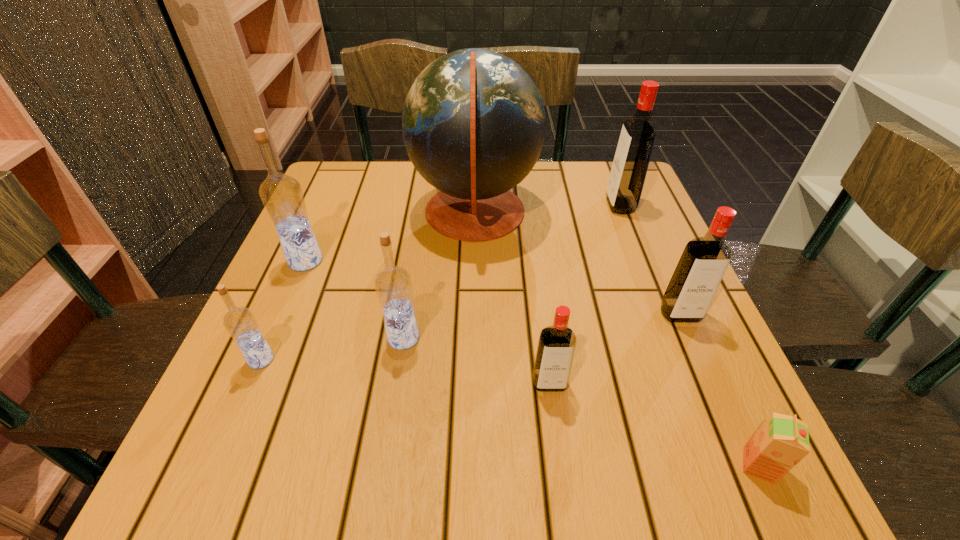
This screenshot has width=960, height=540. Find the location of `blue vodka that is the third nearest to the fifth nearest object`. blue vodka that is the third nearest to the fifth nearest object is located at coordinates (240, 322).

This screenshot has height=540, width=960. I want to click on blue vodka that stands as the closest to the fifth nearest vodka, so click(x=240, y=322).

Locate which red vodka ranks in proximity to the nearest vodka. Please provide its 2D coordinates. Your answer should be formatted as a tuple, i.e. [(x, y)], where the tuple contains the x and y coordinates of a point satisfying the conditions above.

[(703, 263)]

Identify the location of red vodka object that ranks as the closest to the shortest object. The image size is (960, 540). (703, 263).

At what (x,y) coordinates should I click in order to perform the action: click on vacant space that satisfies the following two spatial constraints: 1. on the front and back of the second nearest red vodka; 2. on the left side of the orange juice. Please return your answer as a coordinate pair (x, y). The image size is (960, 540). Looking at the image, I should click on (745, 465).

You are a GUI agent. You are given a task and a screenshot of the screen. Output one action in this format:
    pyautogui.click(x=<x>, y=<y>)
    Task: Click on the vacant point that satisfies the following two spatial constraints: 1. on the front and back of the farthest vodka; 2. on the front side of the smallest blue vodka
    Image resolution: width=960 pixels, height=540 pixels.
    Given the screenshot: What is the action you would take?
    pyautogui.click(x=681, y=359)

Locate an element on the screen. free point that satisfies the following two spatial constraints: 1. with the Americas facing the viewer on the orange juice; 2. on the right side of the tallest object is located at coordinates (471, 465).